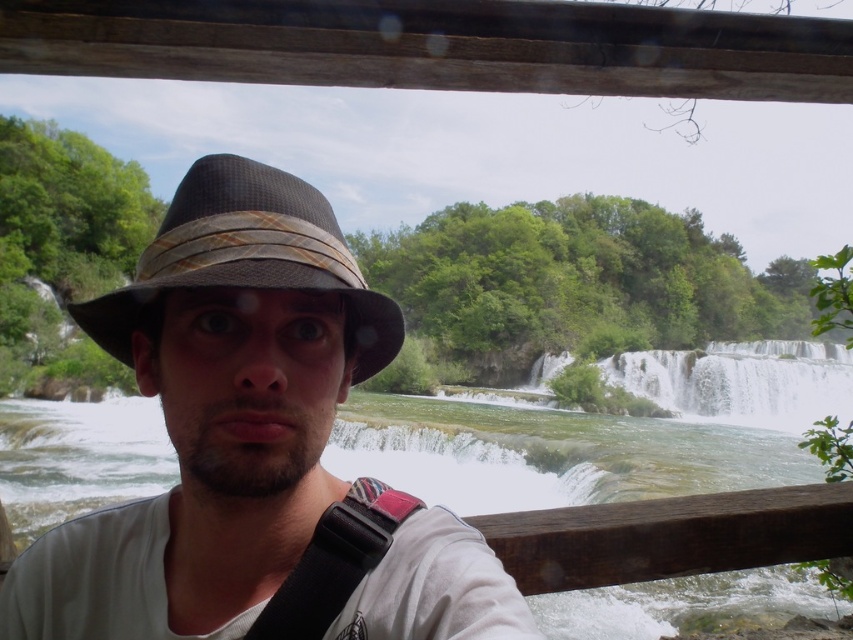
Between point (262, 195) and point (347, 492), which one is positioned behind?

The point (347, 492) is behind.

Which is below, textured brown fedora at center or black leather strap at center?

black leather strap at center is lower down.

Find the location of a particular element. textured brown fedora at center is located at coordinates (247, 257).

This screenshot has height=640, width=853. Identify the location of textured brown fedora at center. (247, 257).

Does matte brown hat at center appear on the right side of black leather strap at center?

In fact, matte brown hat at center is to the left of black leather strap at center.

Who is more forward, (416,547) or (297,621)?

Point (297,621)

At what (x,y) coordinates should I click in order to perform the action: click on matte brown hat at center. Please return your answer as a coordinate pair (x, y). Image resolution: width=853 pixels, height=640 pixels. Looking at the image, I should click on (254, 449).

Looking at this image, which is more to the left, matte brown hat at center or textured brown fedora at center?

textured brown fedora at center

Who is more forward, (109, 316) or (164, 260)?

Point (164, 260) is in front.

Where is `matte brown hat at center`? The image size is (853, 640). matte brown hat at center is located at coordinates (254, 449).

This screenshot has height=640, width=853. What are the coordinates of `matte brown hat at center` in the screenshot? It's located at (254, 449).